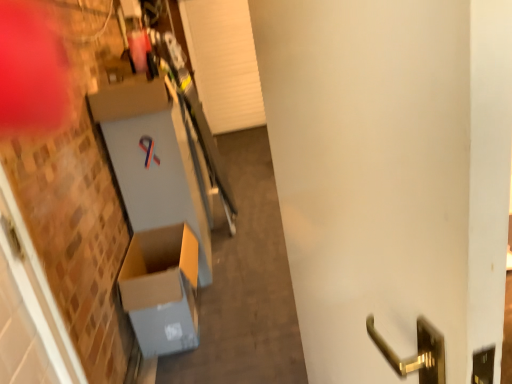
Question: Is white glossy door handle at center right positioned beyond the bounds of brown cardboard box at lower left?

Choices:
 (A) yes
 (B) no

Answer: (A)

Question: Is the position of white glossy door handle at center right more distant than that of brown cardboard box at lower left?

Choices:
 (A) no
 (B) yes

Answer: (A)

Question: Does white glossy door handle at center right turn towards brown cardboard box at lower left?

Choices:
 (A) no
 (B) yes

Answer: (A)

Question: From the image's perspective, is white glossy door handle at center right over brown cardboard box at lower left?

Choices:
 (A) no
 (B) yes

Answer: (B)

Question: Is white glossy door handle at center right shorter than brown cardboard box at lower left?

Choices:
 (A) yes
 (B) no

Answer: (B)

Question: Is white glossy door handle at center right bigger than brown cardboard box at lower left?

Choices:
 (A) no
 (B) yes

Answer: (B)

Question: Is the position of brown cardboard box at lower left more distant than that of white glossy door handle at center right?

Choices:
 (A) no
 (B) yes

Answer: (B)

Question: Can you confirm if brown cardboard box at lower left is smaller than white glossy door handle at center right?

Choices:
 (A) yes
 (B) no

Answer: (A)

Question: Is brown cardboard box at lower left taller than white glossy door handle at center right?

Choices:
 (A) no
 (B) yes

Answer: (A)

Question: From the image's perspective, does brown cardboard box at lower left appear higher than white glossy door handle at center right?

Choices:
 (A) no
 (B) yes

Answer: (A)

Question: Is brown cardboard box at lower left at the right side of white glossy door handle at center right?

Choices:
 (A) yes
 (B) no

Answer: (B)

Question: Is the position of brown cardboard box at lower left less distant than that of white glossy door handle at center right?

Choices:
 (A) no
 (B) yes

Answer: (A)

Question: Considering the positions of white glossy door handle at center right and brown cardboard box at lower left in the image, is white glossy door handle at center right bigger or smaller than brown cardboard box at lower left?

Choices:
 (A) big
 (B) small

Answer: (A)